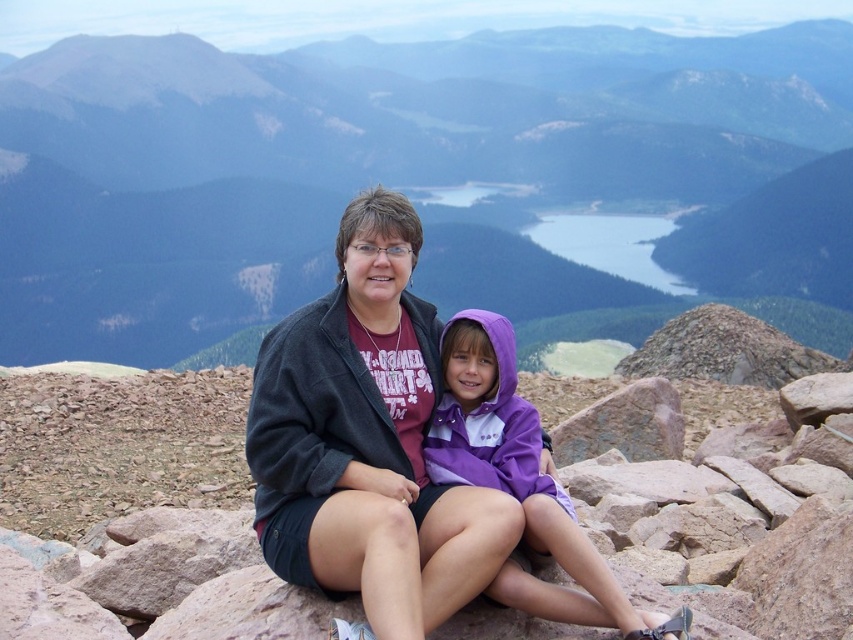
You are a photographer trying to capture a photo of the dark gray jacket at center and the purple fleece jacket at center. Based on their positions, which jacket should you focus on first if you want to ensure both are in sharp focus?

The dark gray jacket at center is located above the purple fleece jacket at center, so you should focus on the purple fleece jacket at center first since it is closer to the camera, ensuring both will be in focus when using depth of field appropriately.

In the scene shown: You are planning to take a photo of the dark gray jacket at center and the purple fleece jacket at center. Based on their sizes, which jacket will appear bigger in the photo?

The dark gray jacket at center will appear bigger in the photo because it is larger in size than the purple fleece jacket at center.

You are planning to take a photo of the two people wearing the dark gray jacket at center and the dark gray fleece sweatshirt at center. Which clothing item should you focus on if you want to capture the larger one in your shot?

The dark gray jacket at center is larger in size compared to the dark gray fleece sweatshirt at center, so you should focus on the dark gray jacket at center to capture the larger one.